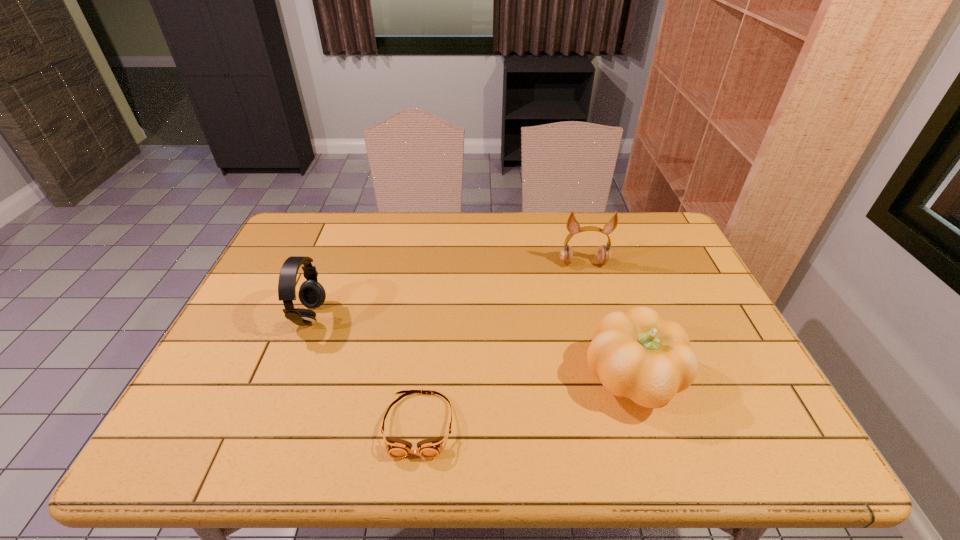
Where is `pumpkin present at the near edge`? pumpkin present at the near edge is located at coordinates (636, 354).

The width and height of the screenshot is (960, 540). What are the coordinates of `goggles that is at the near edge` in the screenshot? It's located at (430, 448).

This screenshot has width=960, height=540. In order to click on object that is at the left edge in this screenshot , I will do `click(311, 294)`.

In the image, there is a desktop. Find the location of `free space at the far edge`. free space at the far edge is located at coordinates (346, 252).

In the image, there is a desktop. Identify the location of free region at the near edge. (323, 447).

You are a GUI agent. You are given a task and a screenshot of the screen. Output one action in this format:
    pyautogui.click(x=<x>, y=<y>)
    Task: Click on the free region at the right edge of the desktop
    The width and height of the screenshot is (960, 540).
    Given the screenshot: What is the action you would take?
    pyautogui.click(x=700, y=383)

Find the location of a particular element. Image resolution: width=960 pixels, height=540 pixels. free space at the far left corner of the desktop is located at coordinates coord(292,220).

I want to click on free space at the far right corner of the desktop, so click(x=663, y=248).

Locate an element on the screen. The image size is (960, 540). empty location between the left earphone and the farthest object is located at coordinates (447, 290).

Find the location of a particular element. vacant area that lies between the left earphone and the shortest object is located at coordinates (365, 371).